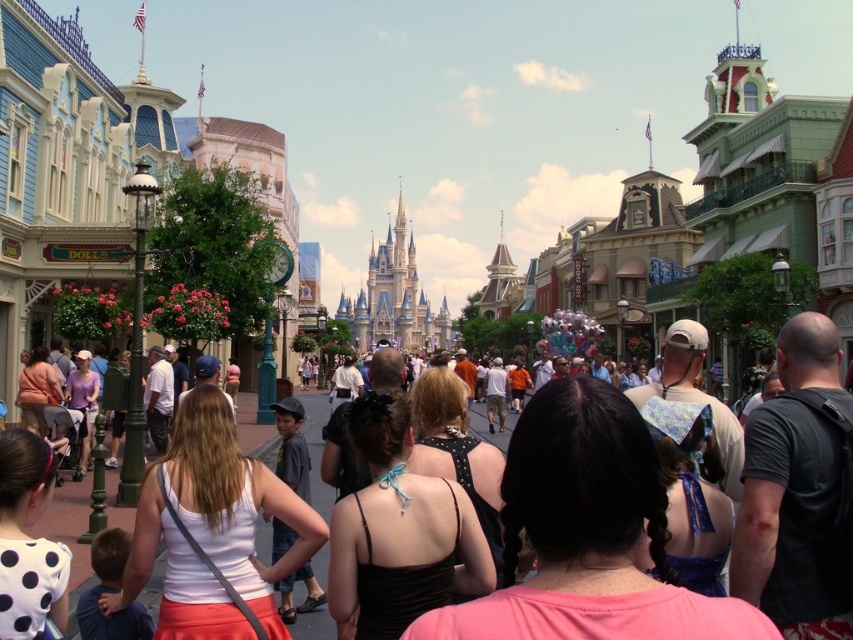
Question: Estimate the real-world distances between objects in this image. Which object is closer to the black satin tank top at center?

Choices:
 (A) black leather backpack at right
 (B) black satin dress at center
 (C) white matte tank top at center

Answer: (C)

Question: Which of the following is the closest to the observer?

Choices:
 (A) click(469, 474)
 (B) click(90, 424)

Answer: (A)

Question: Can you confirm if black satin dress at center is bigger than black satin tank top at center?

Choices:
 (A) yes
 (B) no

Answer: (A)

Question: Is black satin tank top at center positioned behind white dotted shirt at lower left?

Choices:
 (A) yes
 (B) no

Answer: (A)

Question: Does black satin dress at center appear under black satin tank top at center?

Choices:
 (A) no
 (B) yes

Answer: (B)

Question: Which of these objects is positioned farthest from the white matte tank top at center?

Choices:
 (A) black satin tank top at center
 (B) matte purple shirt at center

Answer: (B)